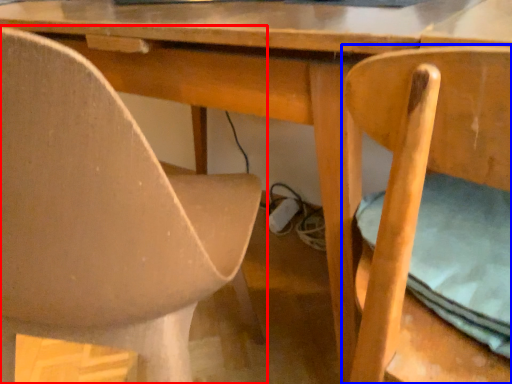
Question: Which point is closer to the camera, chair (highlighted by a red box) or chair (highlighted by a blue box)?

Choices:
 (A) chair
 (B) chair

Answer: (B)